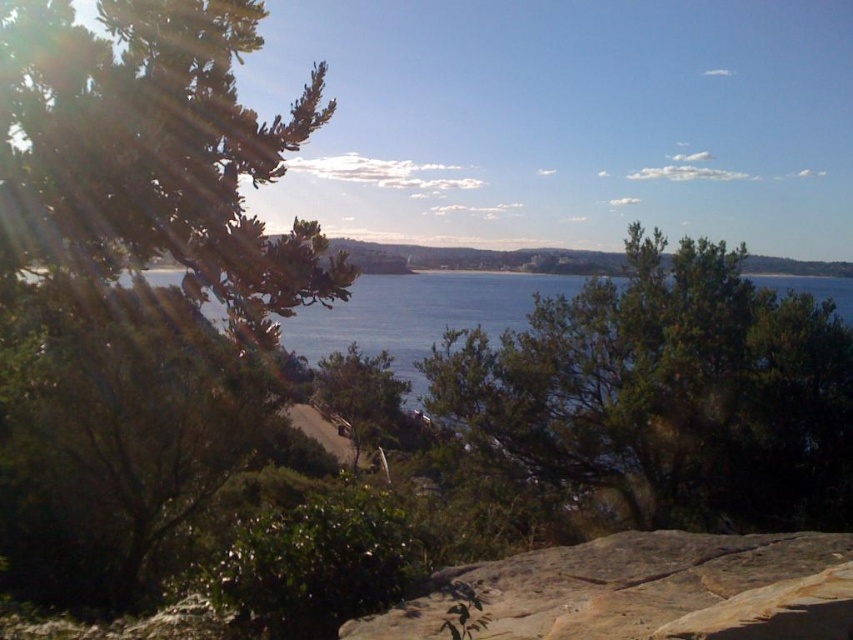
You are planning to place a picnic blanket in this coastal scene. The picnic blanket requires a flat area larger than the brown rough rock at lower center. Based on the scene description, can you determine if the green leafy tree at center provides enough space for the picnic blanket?

The green leafy tree at center is bigger than the brown rough rock at lower center. Since the picnic blanket requires an area larger than the brown rough rock, the space under the green leafy tree at center may be sufficient, but the scene description does not explicitly mention the availability of flat areas. Therefore, it is uncertain if the space is suitable for the picnic blanket.

You are standing on the beach and want to walk from the brown rough rock at lower center to the green leafy tree at center. Which direction should you head to reach the tree?

The green leafy tree at center is positioned on the right side of brown rough rock at lower center, so you should head to the right to reach the tree.

You are standing at the elevated vantage point overlooking the coastal landscape. There are two points marked in the scene, point (73, 65) and point (704, 544). If you were to move towards the first point, would you be moving closer to the foreground or further away from it?

Moving towards point (73, 65) would mean moving closer to the foreground because it is further to the camera than point (704, 544).